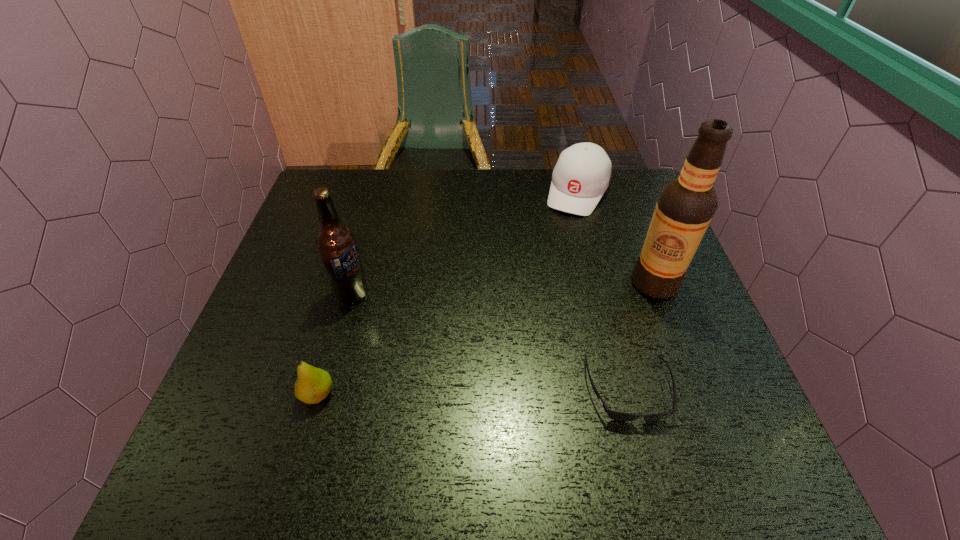
Find the location of `baseball cap present at the right edge`. baseball cap present at the right edge is located at coordinates coord(582,174).

Image resolution: width=960 pixels, height=540 pixels. What are the coordinates of `alcohol positioned at the right edge` in the screenshot? It's located at click(686, 205).

Find the location of a particular element. object that is at the near left corner is located at coordinates (313, 384).

At what (x,y) coordinates should I click in order to perform the action: click on object that is positioned at the far right corner. Please return your answer as a coordinate pair (x, y). Image resolution: width=960 pixels, height=540 pixels. Looking at the image, I should click on point(582,174).

You are a GUI agent. You are given a task and a screenshot of the screen. Output one action in this format:
    pyautogui.click(x=<x>, y=<y>)
    Task: Click on the object that is positioned at the near right corner
    The height and width of the screenshot is (540, 960).
    Given the screenshot: What is the action you would take?
    pyautogui.click(x=614, y=415)

You are a GUI agent. You are given a task and a screenshot of the screen. Output one action in this format:
    pyautogui.click(x=<x>, y=<y>)
    Task: Click on the free space at the far edge of the desktop
    Image resolution: width=960 pixels, height=540 pixels.
    Given the screenshot: What is the action you would take?
    pyautogui.click(x=550, y=208)

This screenshot has width=960, height=540. In the image, there is a desktop. Find the location of `free region at the near edge`. free region at the near edge is located at coordinates (498, 424).

Where is `vacant area at the left edge`? vacant area at the left edge is located at coordinates (314, 218).

The width and height of the screenshot is (960, 540). I want to click on vacant region at the right edge of the desktop, so click(684, 309).

In the image, there is a desktop. What are the coordinates of `vacant space at the far right corner` in the screenshot? It's located at (642, 184).